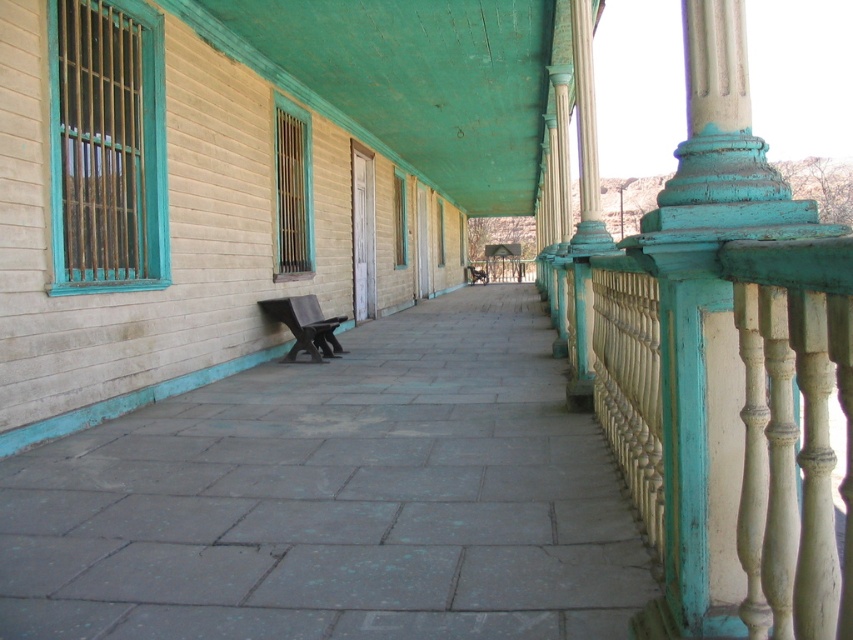
Is gray stone pavement at center to the left of wooden park bench at center from the viewer's perspective?

In fact, gray stone pavement at center is to the right of wooden park bench at center.

Consider the image. Between gray stone pavement at center and wooden park bench at center, which one is positioned higher?

wooden park bench at center

What do you see at coordinates (337, 499) in the screenshot?
I see `gray stone pavement at center` at bounding box center [337, 499].

Locate an element on the screen. The image size is (853, 640). gray stone pavement at center is located at coordinates (337, 499).